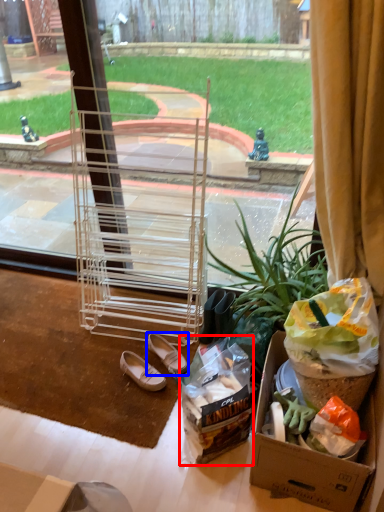
Question: Among these objects, which one is farthest to the camera, waste (highlighted by a red box) or footwear (highlighted by a blue box)?

Choices:
 (A) waste
 (B) footwear

Answer: (B)